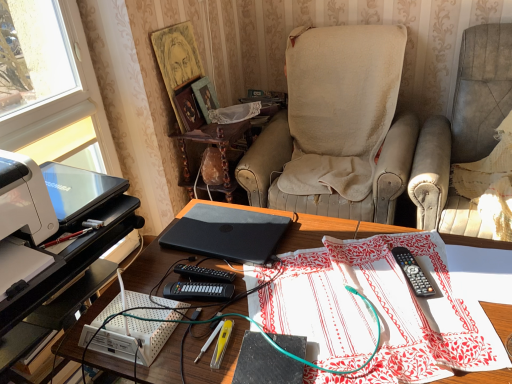
I want to click on free space in front of orange matte laptop at center, placed as the 2th laptop when sorted from left to right, so click(245, 294).